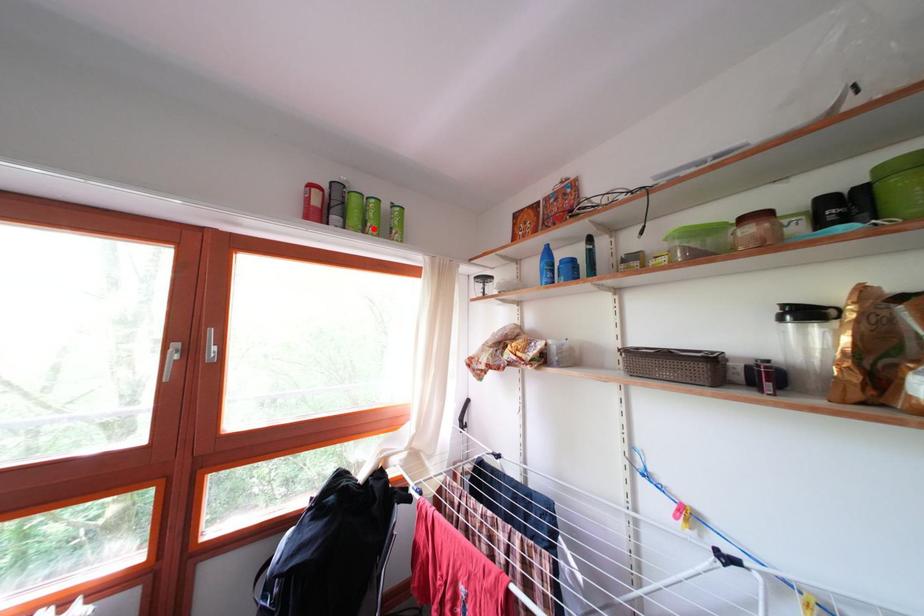
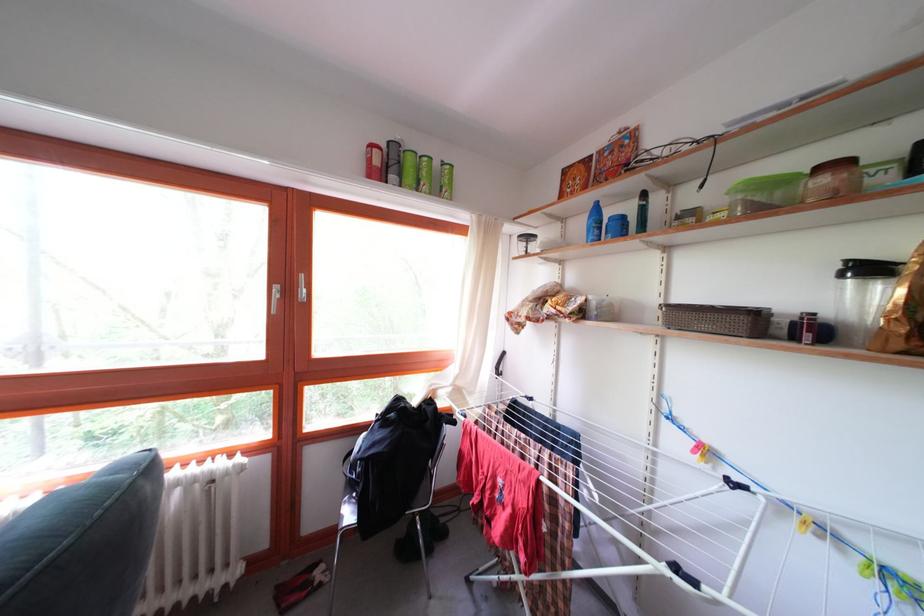
Locate, in the second image, the point that corresponds to the highlighted location in the first image.

(428, 187)